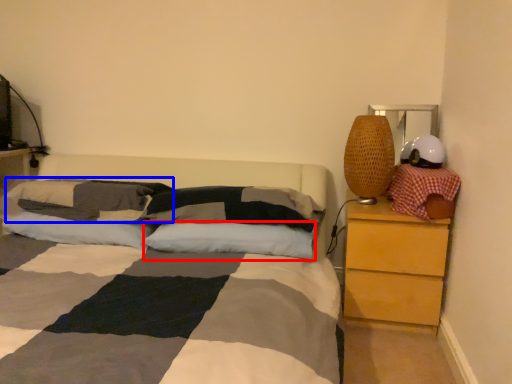
Question: Which object is further to the camera taking this photo, pillow (highlighted by a red box) or pillow (highlighted by a blue box)?

Choices:
 (A) pillow
 (B) pillow

Answer: (B)